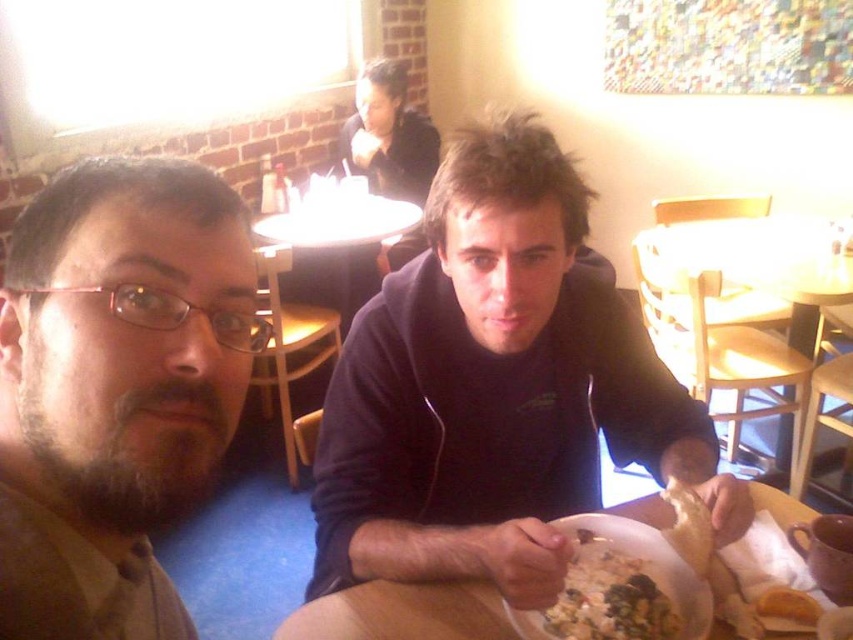
Is dark blue hoodie at center to the left of white plastic plate at center from the viewer's perspective?

Incorrect, dark blue hoodie at center is not on the left side of white plastic plate at center.

At what (x,y) coordinates should I click in order to perform the action: click on dark blue hoodie at center. Please return your answer as a coordinate pair (x, y). Image resolution: width=853 pixels, height=640 pixels. Looking at the image, I should click on (496, 388).

Between point (643, 620) and point (701, 545), which one is positioned in front?

Point (643, 620) is more forward.

Is point (583, 637) farther from viewer compared to point (693, 538)?

No, it is not.

Locate an element on the screen. white creamy pasta at lower center is located at coordinates (612, 595).

Is wooden at right closer to the viewer compared to golden crispy bread at lower right?

No, it is not.

Locate an element on the screen. wooden at right is located at coordinates (746, 324).